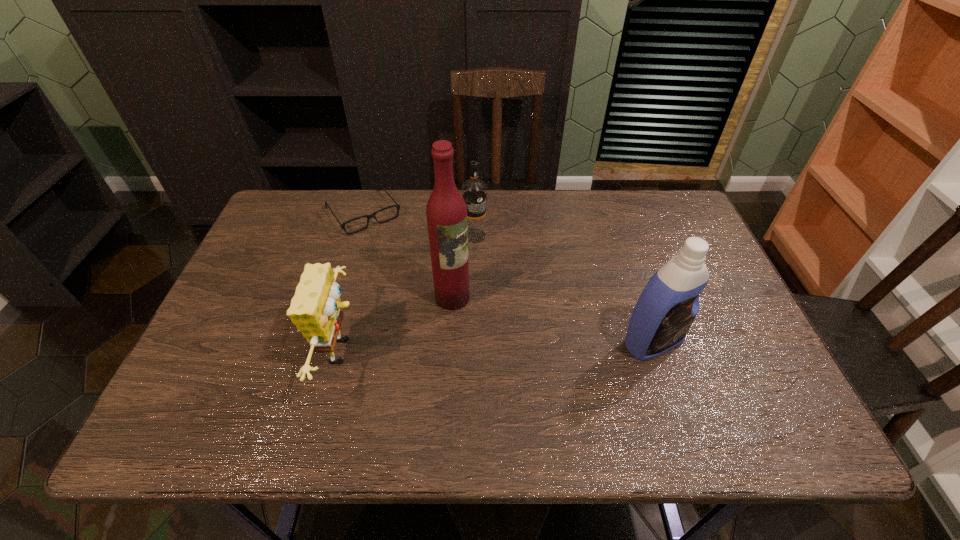
At what (x,y) coordinates should I click in order to perform the action: click on sponge. Please return your answer as a coordinate pair (x, y). The width and height of the screenshot is (960, 540). Looking at the image, I should click on (316, 309).

Find the location of a particular element. The height and width of the screenshot is (540, 960). the rightmost object is located at coordinates (668, 305).

The image size is (960, 540). Find the location of `detergent`. detergent is located at coordinates (668, 305).

Locate an element on the screen. This screenshot has height=540, width=960. the shortest object is located at coordinates (397, 206).

The width and height of the screenshot is (960, 540). I want to click on liquor, so click(x=446, y=212).

In order to click on vodka in this screenshot , I will do click(x=474, y=191).

At what (x,y) coordinates should I click in order to perform the action: click on vacant point located 0.250m on the face of the sponge. Please return your answer as a coordinate pair (x, y). Looking at the image, I should click on coord(471,351).

Identify the location of free space located on the left of the detergent. The height and width of the screenshot is (540, 960). (476, 342).

In order to click on free space located on the front-facing side of the spectacles in this screenshot , I will do `click(395, 254)`.

Find the location of `free location located 0.150m on the front-facing side of the spectacles`. free location located 0.150m on the front-facing side of the spectacles is located at coordinates (400, 262).